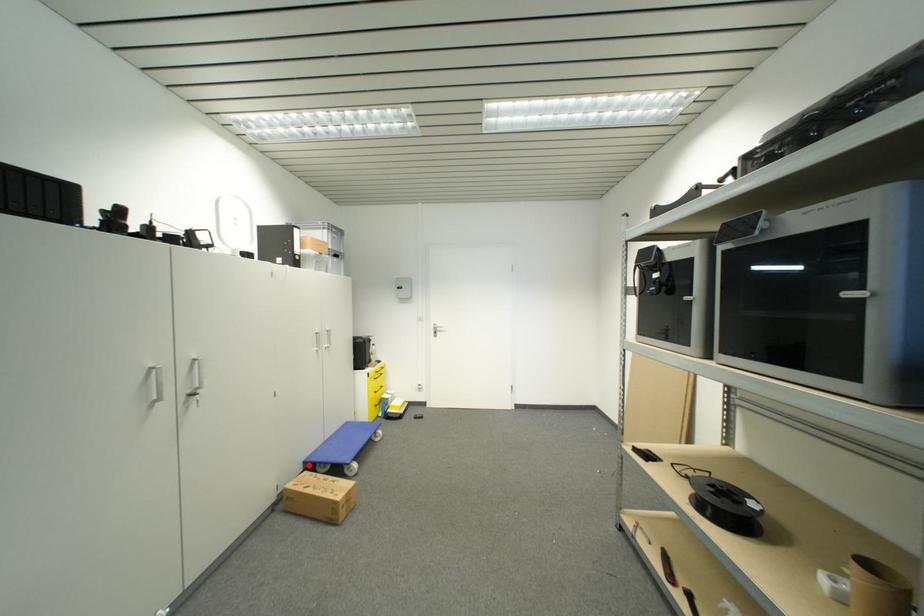
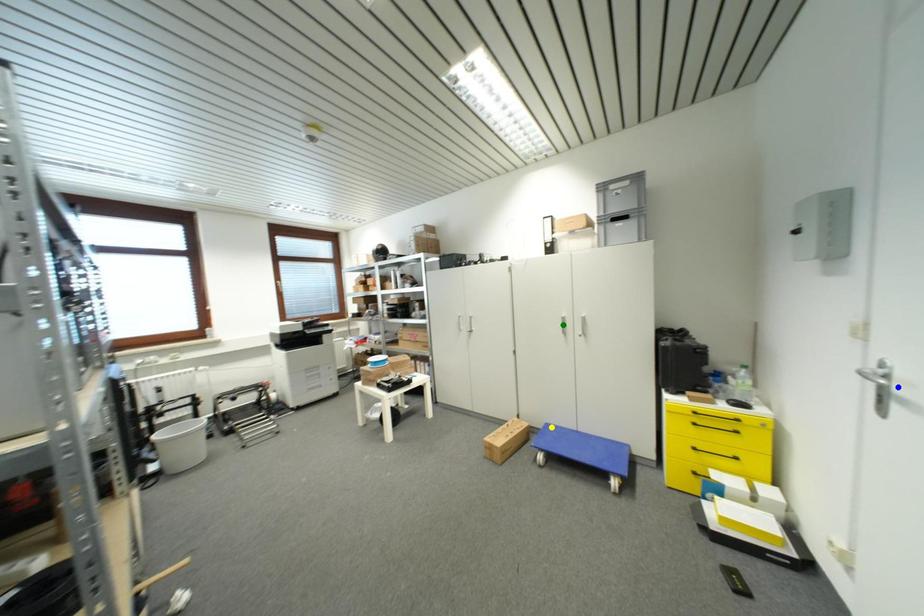
Question: I am providing you with two images of the same scene from different viewpoints. A red point is marked on the first image. You are given multiple points on the second image. In image 2, which mark is for the same physical point as the one in image 1?

Choices:
 (A) green point
 (B) blue point
 (C) yellow point

Answer: (C)